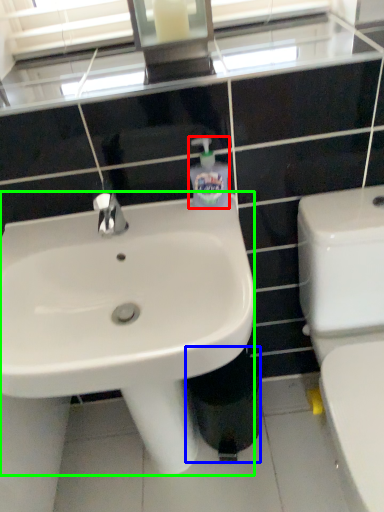
Question: Based on their relative distances, which object is farther from toiletries (highlighted by a red box)? Choose from trash bin/can (highlighted by a blue box) and sink (highlighted by a green box).

Choices:
 (A) trash bin/can
 (B) sink

Answer: (A)